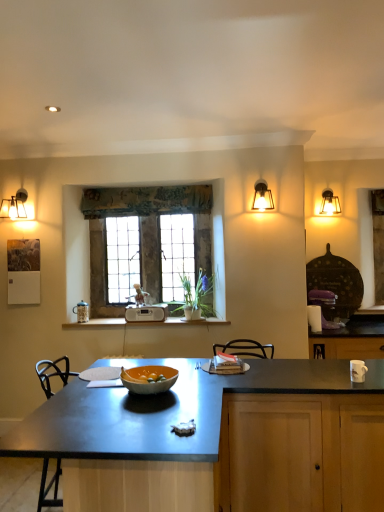
Question: Is white plastic radio at center closer to the viewer compared to textured fabric curtain at upper center?

Choices:
 (A) no
 (B) yes

Answer: (B)

Question: Is textured fabric curtain at upper center completely or partially inside white plastic radio at center?

Choices:
 (A) no
 (B) yes

Answer: (A)

Question: From the image's perspective, is white plastic radio at center under textured fabric curtain at upper center?

Choices:
 (A) no
 (B) yes

Answer: (B)

Question: From the image's perspective, is white plastic radio at center located above textured fabric curtain at upper center?

Choices:
 (A) yes
 (B) no

Answer: (B)

Question: Is white plastic radio at center facing away from textured fabric curtain at upper center?

Choices:
 (A) yes
 (B) no

Answer: (B)

Question: Can you confirm if white plastic radio at center is shorter than textured fabric curtain at upper center?

Choices:
 (A) yes
 (B) no

Answer: (A)

Question: Considering the relative sizes of metallic glass lampshade at upper right and orange matte glass bowl at center in the image provided, is metallic glass lampshade at upper right wider than orange matte glass bowl at center?

Choices:
 (A) no
 (B) yes

Answer: (A)

Question: Does metallic glass lampshade at upper right have a greater height compared to orange matte glass bowl at center?

Choices:
 (A) yes
 (B) no

Answer: (A)

Question: From a real-world perspective, is metallic glass lampshade at upper right on orange matte glass bowl at center?

Choices:
 (A) no
 (B) yes

Answer: (B)

Question: Is metallic glass lampshade at upper right facing away from orange matte glass bowl at center?

Choices:
 (A) no
 (B) yes

Answer: (A)

Question: Is metallic glass lampshade at upper right aimed at orange matte glass bowl at center?

Choices:
 (A) yes
 (B) no

Answer: (B)

Question: Does metallic glass lampshade at upper right appear on the right side of orange matte glass bowl at center?

Choices:
 (A) no
 (B) yes

Answer: (B)

Question: Is stained glass window at center oriented towards matte glass sconce at upper right?

Choices:
 (A) yes
 (B) no

Answer: (B)